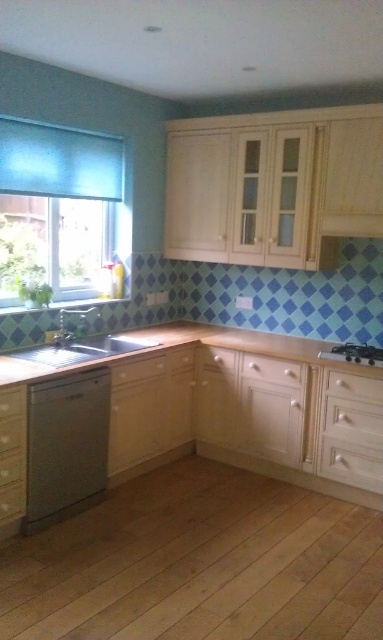
You are organizing the kitchen and need to place a new appliance that requires a space between the satin silver sink at lower left and the white wood drawer at center. Is there enough space between them for the appliance?

The satin silver sink at lower left is to the left of the white wood drawer at center, so there is space between them for the appliance.

Please provide the 2D coordinates of the wooden countertop at lower center in the image. The answer should be in the format of a point with two decimal places, such as 0.54, 0.48.

The 2D coordinates of the wooden countertop at lower center are at point [183,345].